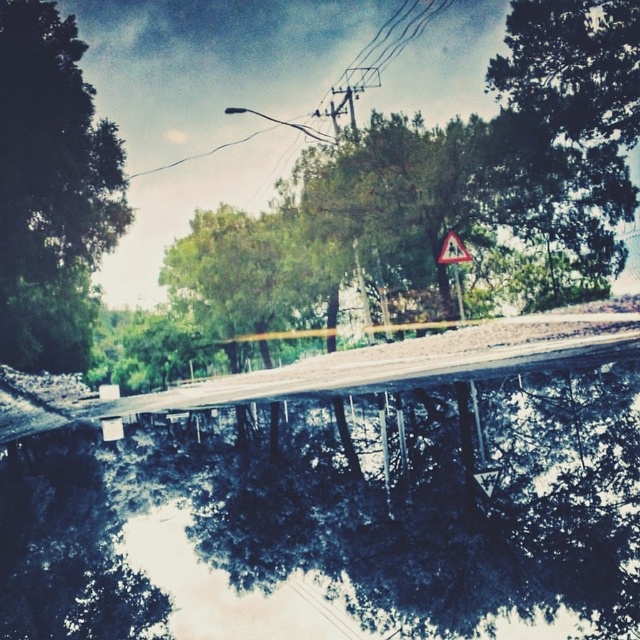
You are a drone operator who needs to capture a photo of the yellow reflective plastic triangular warning sign at upper center and the dark reflective water at center. The drone has a camera with a 50mm lens. Knowing that a 50mm lens has a field of view of approximately 46 degrees, can you estimate if both objects will fit in the frame when the drone is positioned directly above the warning sign at a height of 10 meters?

The dark reflective water at center is 13.14 meters away from the yellow reflective plastic triangular warning sign at upper center. When the drone is 10 meters above the warning sign, the distance between the two objects exceeds the maximum horizontal coverage of the 50mm lens at this height, so they might not both fit in the frame.

You are a pedestrian crossing the bridge and notice the dark reflective water at center and the yellow reflective plastic triangular warning sign at upper center. Which object do you think is bigger in size?

The dark reflective water at center is larger in size than the yellow reflective plastic triangular warning sign at upper center, so the dark reflective water at center is bigger.

You are a landscape architect planning to plant a new tree between the green leafy tree at left and the green leafy tree at upper right. What is the minimum distance you should maintain between the new tree and each existing tree to ensure they all have enough space?

The green leafy tree at left and green leafy tree at upper right are 27.05 meters apart. To ensure enough space, the new tree should be placed at least 13.525 meters away from each existing tree, maintaining equal distance between all three.